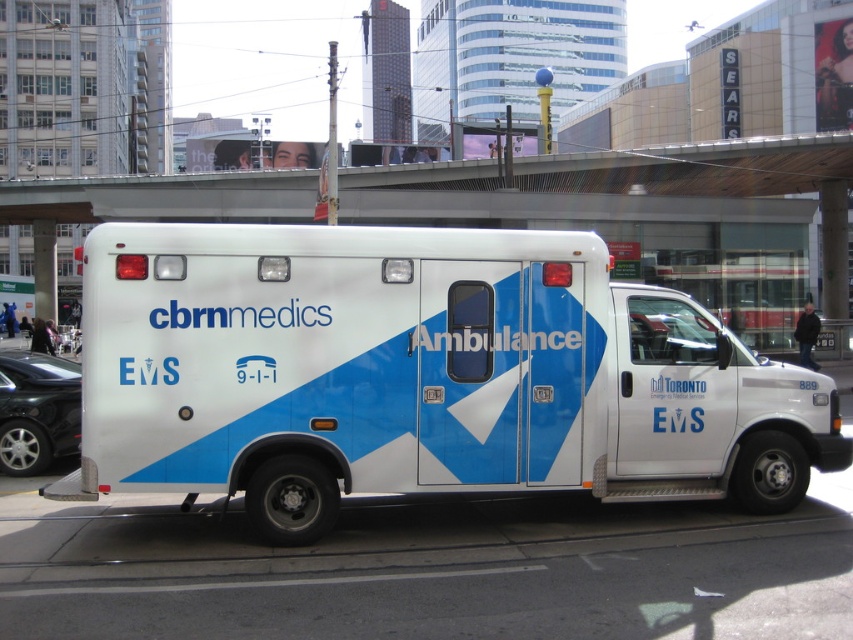
Question: Which of the following is the farthest from the observer?

Choices:
 (A) concrete bridge at upper center
 (B) white glossy ambulance at center
 (C) white plastic license plate at center

Answer: (C)

Question: Which point is closer to the camera?

Choices:
 (A) shiny black car at lower left
 (B) concrete bridge at upper center

Answer: (A)

Question: Can you confirm if concrete bridge at upper center is bigger than white plastic license plate at center?

Choices:
 (A) no
 (B) yes

Answer: (B)

Question: Can you confirm if shiny black car at lower left is bigger than white plastic license plate at center?

Choices:
 (A) no
 (B) yes

Answer: (B)

Question: Is white glossy ambulance at center below concrete bridge at upper center?

Choices:
 (A) yes
 (B) no

Answer: (A)

Question: Based on their relative distances, which object is farther from the white glossy ambulance at center?

Choices:
 (A) shiny black car at lower left
 (B) concrete bridge at upper center
 (C) white plastic license plate at center

Answer: (B)